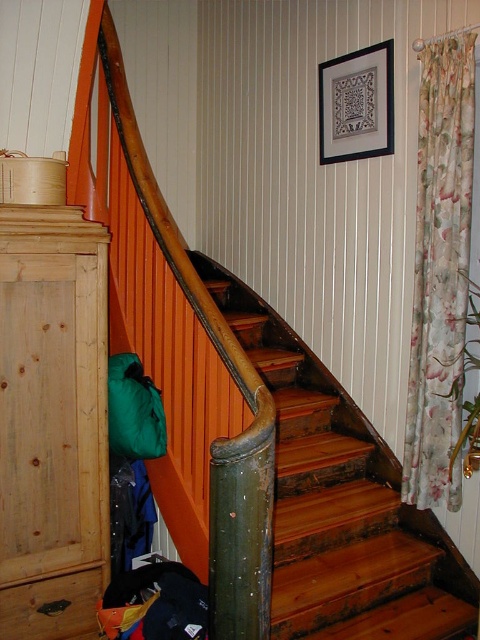
Between point (456, 625) and point (456, 433), which one is positioned behind?

Point (456, 433)

Is point (349, 582) positioned behind point (409, 502)?

No, it is in front of (409, 502).

What do you see at coordinates (340, 500) in the screenshot? I see `wooden stairs at center` at bounding box center [340, 500].

This screenshot has width=480, height=640. Find the location of `wooden stairs at center`. wooden stairs at center is located at coordinates (340, 500).

Who is taller, wooden stairs at center or green fabric sleeping bag at lower left?

wooden stairs at center

Does point (324, 408) lie in front of point (158, 428)?

No, it is not.

Image resolution: width=480 pixels, height=640 pixels. Identify the location of wooden stairs at center. (340, 500).

Is floral fabric curtain at right positioned in front of green fabric sleeping bag at lower left?

No, it is behind green fabric sleeping bag at lower left.

Is point (456, 100) positioned behind point (131, 387)?

Yes, point (456, 100) is farther from viewer.

Is point (414, 499) farther from viewer compared to point (146, 458)?

Yes, it is.

At what (x,y) coordinates should I click in order to perform the action: click on floral fabric curtain at right. Please return your answer as a coordinate pair (x, y). Looking at the image, I should click on (440, 268).